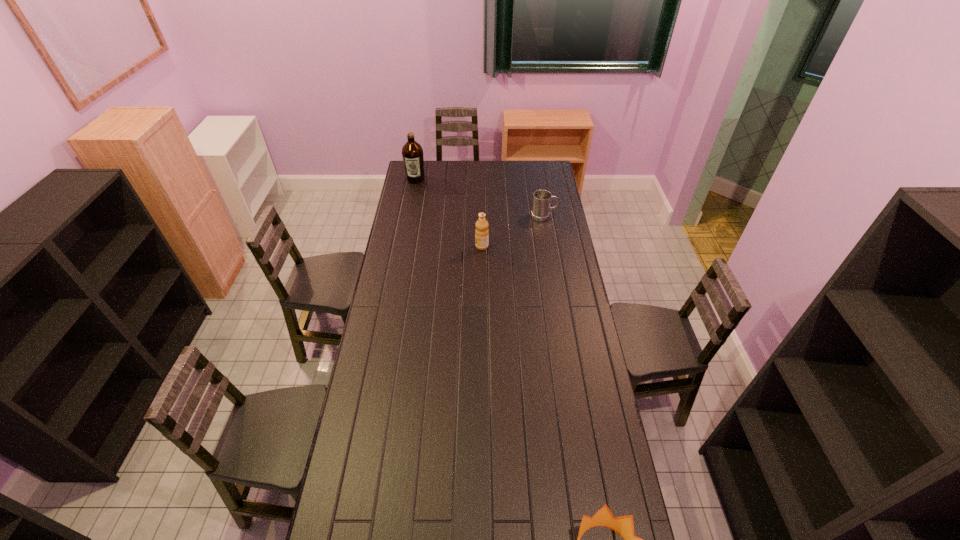
The height and width of the screenshot is (540, 960). I want to click on object that is the closest to the shorter olive oil, so click(x=541, y=208).

Where is `object that is the third closest to the farther olive oil`? The height and width of the screenshot is (540, 960). object that is the third closest to the farther olive oil is located at coordinates pyautogui.click(x=623, y=525).